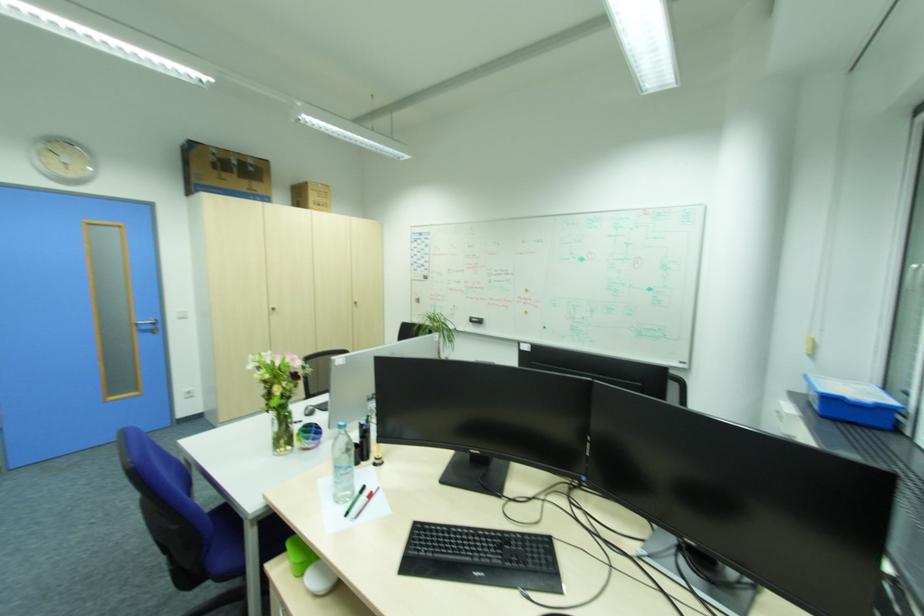
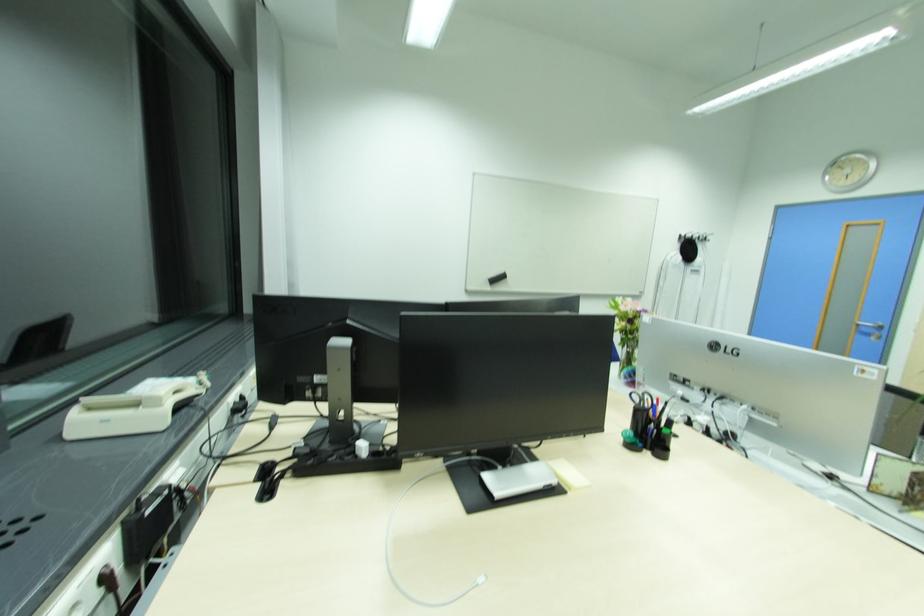
In the second image, find the point that corresponds to the point at 126,227 in the first image.

(882, 224)